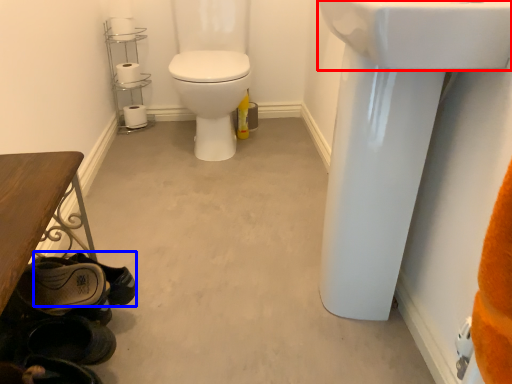
Question: Which of the following is the farthest to the observer, sink (highlighted by a red box) or shoe (highlighted by a blue box)?

Choices:
 (A) sink
 (B) shoe

Answer: (B)